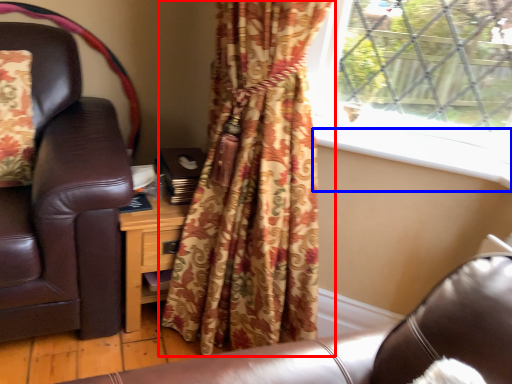
Question: Which object appears farthest to the camera in this image, curtain (highlighted by a red box) or window sill (highlighted by a blue box)?

Choices:
 (A) curtain
 (B) window sill

Answer: (B)